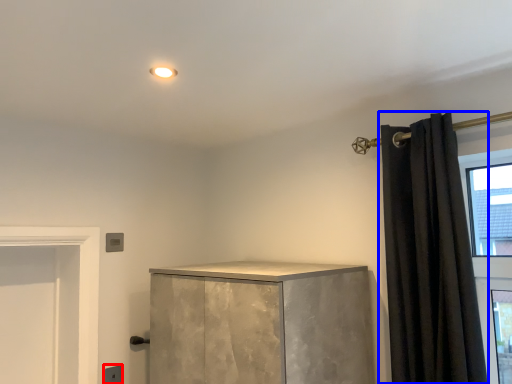
Question: Which object appears closest to the camera in this image, electric outlet (highlighted by a red box) or curtain (highlighted by a blue box)?

Choices:
 (A) electric outlet
 (B) curtain

Answer: (B)